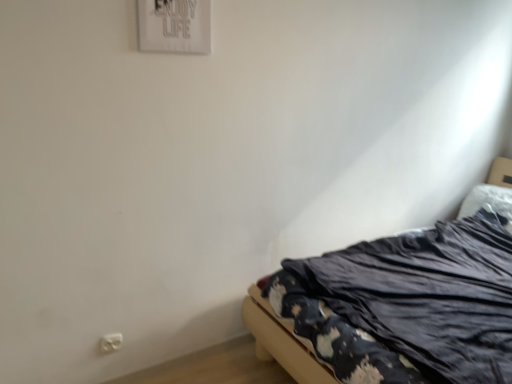
At what (x,y) coordinates should I click in order to perform the action: click on white plastic electric outlet at lower left. Please return your answer as a coordinate pair (x, y). This screenshot has width=512, height=384. Looking at the image, I should click on (110, 342).

Describe the element at coordinates (110, 342) in the screenshot. I see `white plastic electric outlet at lower left` at that location.

This screenshot has width=512, height=384. What do you see at coordinates (397, 307) in the screenshot?
I see `dark fabric bed at lower right` at bounding box center [397, 307].

In order to face dark fabric bed at lower right, should I rotate leftwards or rightwards?

To align with it, rotate right about 27.333°.

You are a GUI agent. You are given a task and a screenshot of the screen. Output one action in this format:
    pyautogui.click(x=<x>, y=<y>)
    Task: Click on the dark fabric bed at lower right
    
    Given the screenshot: What is the action you would take?
    pyautogui.click(x=397, y=307)

At what (x,y) coordinates should I click in order to perform the action: click on white plastic electric outlet at lower left. Please return your answer as a coordinate pair (x, y). The image size is (512, 384). Looking at the image, I should click on (110, 342).

Can you confirm if dark fabric bed at lower right is positioned to the left of white plastic electric outlet at lower left?

No, dark fabric bed at lower right is not to the left of white plastic electric outlet at lower left.

Is dark fabric bed at lower right in front of or behind white plastic electric outlet at lower left in the image?

Clearly, dark fabric bed at lower right is in front of white plastic electric outlet at lower left.

Considering the points (501, 227) and (103, 351), which point is behind, point (501, 227) or point (103, 351)?

The point (501, 227) is more distant.

From the image's perspective, which is above, dark fabric bed at lower right or white plastic electric outlet at lower left?

dark fabric bed at lower right, from the image's perspective.

From a real-world perspective, which is physically above, dark fabric bed at lower right or white plastic electric outlet at lower left?

dark fabric bed at lower right is physically above.

Considering the relative sizes of dark fabric bed at lower right and white plastic electric outlet at lower left in the image provided, is dark fabric bed at lower right thinner than white plastic electric outlet at lower left?

In fact, dark fabric bed at lower right might be wider than white plastic electric outlet at lower left.

Is dark fabric bed at lower right shorter than white plastic electric outlet at lower left?

Incorrect, the height of dark fabric bed at lower right does not fall short of that of white plastic electric outlet at lower left.

Is dark fabric bed at lower right bigger than white plastic electric outlet at lower left?

Yes, dark fabric bed at lower right is bigger than white plastic electric outlet at lower left.

Would you say dark fabric bed at lower right contains white plastic electric outlet at lower left?

No, white plastic electric outlet at lower left is not inside dark fabric bed at lower right.

Is dark fabric bed at lower right positioned far away from white plastic electric outlet at lower left?

dark fabric bed at lower right is far away from white plastic electric outlet at lower left.

From the picture: Could you tell me if dark fabric bed at lower right is turned towards white plastic electric outlet at lower left?

No, dark fabric bed at lower right is not turned towards white plastic electric outlet at lower left.

How different are the orientations of dark fabric bed at lower right and white plastic electric outlet at lower left in degrees?

The angle between the facing direction of dark fabric bed at lower right and the facing direction of white plastic electric outlet at lower left is 91 degrees.

How far apart are dark fabric bed at lower right and white plastic electric outlet at lower left?

dark fabric bed at lower right and white plastic electric outlet at lower left are 4.33 feet apart.

Locate an element on the screen. electric outlet below the dark fabric bed at lower right (from the image's perspective) is located at coordinates (110, 342).

Is white plastic electric outlet at lower left to the left or to the right of dark fabric bed at lower right in the image?

white plastic electric outlet at lower left is positioned on dark fabric bed at lower right's left side.

Which object is closer to the camera taking this photo, white plastic electric outlet at lower left or dark fabric bed at lower right?

dark fabric bed at lower right is in front.

Which is less distant, (106, 350) or (506, 213)?

Point (106, 350) is closer to the camera than point (506, 213).

From the image's perspective, is white plastic electric outlet at lower left below dark fabric bed at lower right?

Yes, from the image's perspective, white plastic electric outlet at lower left is below dark fabric bed at lower right.

From a real-world perspective, between white plastic electric outlet at lower left and dark fabric bed at lower right, who is vertically higher?

From a 3D spatial view, dark fabric bed at lower right is above.

Looking at their sizes, would you say white plastic electric outlet at lower left is wider or thinner than dark fabric bed at lower right?

Considering their sizes, white plastic electric outlet at lower left looks slimmer than dark fabric bed at lower right.

Considering the sizes of white plastic electric outlet at lower left and dark fabric bed at lower right in the image, is white plastic electric outlet at lower left taller or shorter than dark fabric bed at lower right?

In the image, white plastic electric outlet at lower left appears to be shorter than dark fabric bed at lower right.

Considering the relative sizes of white plastic electric outlet at lower left and dark fabric bed at lower right in the image provided, is white plastic electric outlet at lower left bigger than dark fabric bed at lower right?

Incorrect, white plastic electric outlet at lower left is not larger than dark fabric bed at lower right.

Choose the correct answer: Is white plastic electric outlet at lower left inside dark fabric bed at lower right or outside it?

white plastic electric outlet at lower left is outside dark fabric bed at lower right.

Is white plastic electric outlet at lower left next to dark fabric bed at lower right?

No.

Is white plastic electric outlet at lower left turned away from dark fabric bed at lower right?

white plastic electric outlet at lower left is not turned away from dark fabric bed at lower right.

From the picture: How different are the orientations of white plastic electric outlet at lower left and dark fabric bed at lower right in degrees?

The angular difference between white plastic electric outlet at lower left and dark fabric bed at lower right is 91 degrees.

The width and height of the screenshot is (512, 384). Identify the location of electric outlet below the dark fabric bed at lower right (from a real-world perspective). (110, 342).

At what (x,y) coordinates should I click in order to perform the action: click on bed in front of the white plastic electric outlet at lower left. Please return your answer as a coordinate pair (x, y). The height and width of the screenshot is (384, 512). Looking at the image, I should click on (397, 307).

Locate an element on the screen. Image resolution: width=512 pixels, height=384 pixels. electric outlet behind the dark fabric bed at lower right is located at coordinates (110, 342).